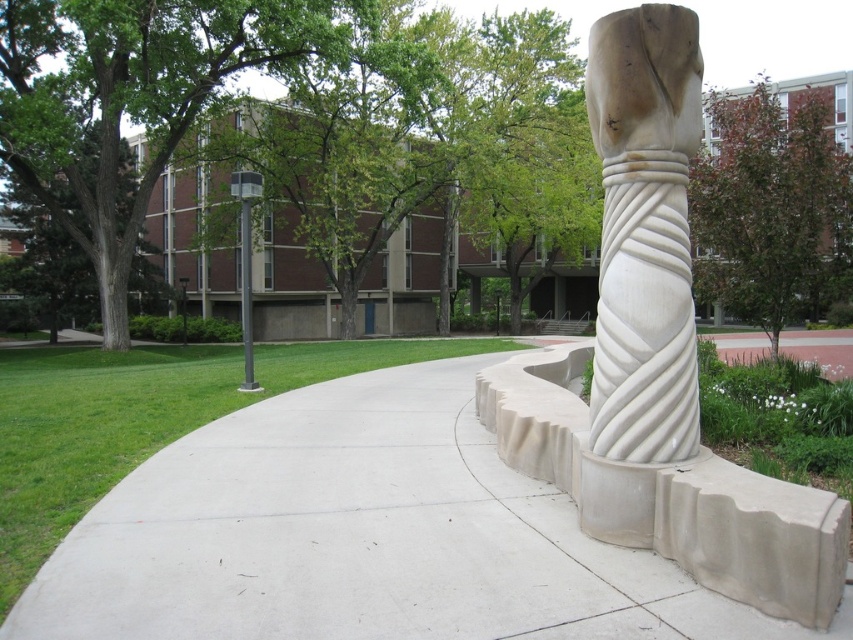
You are a visitor trying to locate the entrance to the campus building. You see the white marble column at center and the metallic pole at upper left. Which object is closer to you as you stand at the starting point of the pathway?

The white marble column at center is closer to you because it is in front of the metallic pole at upper left, indicating it is nearer in the scene.

You are standing on the curved concrete pathway in the foreground of the scene. You want to walk towards the building in the background. Which object, the white concrete pavement at center or the white marble column at center, will you encounter first?

You will encounter the white concrete pavement at center first because it is closer to the viewer than the white marble column at center.

You are standing at the point marked by the coordinates (361, 536) in the image. Based on the scene description, what type of surface are you currently standing on?

The point (361, 536) indicates white concrete pavement at center, so you are standing on white concrete pavement.